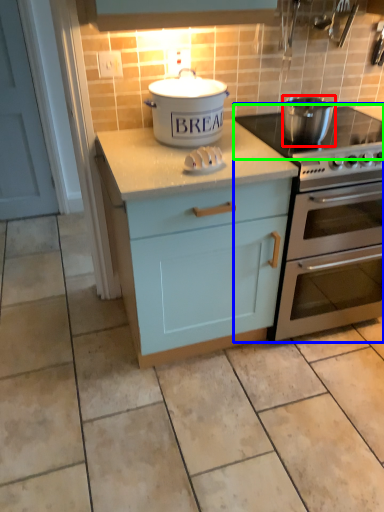
Question: Which object is positioned closest to kitchen appliance (highlighted by a red box)? Select from oven (highlighted by a blue box) and gas stove (highlighted by a green box).

Choices:
 (A) oven
 (B) gas stove

Answer: (B)